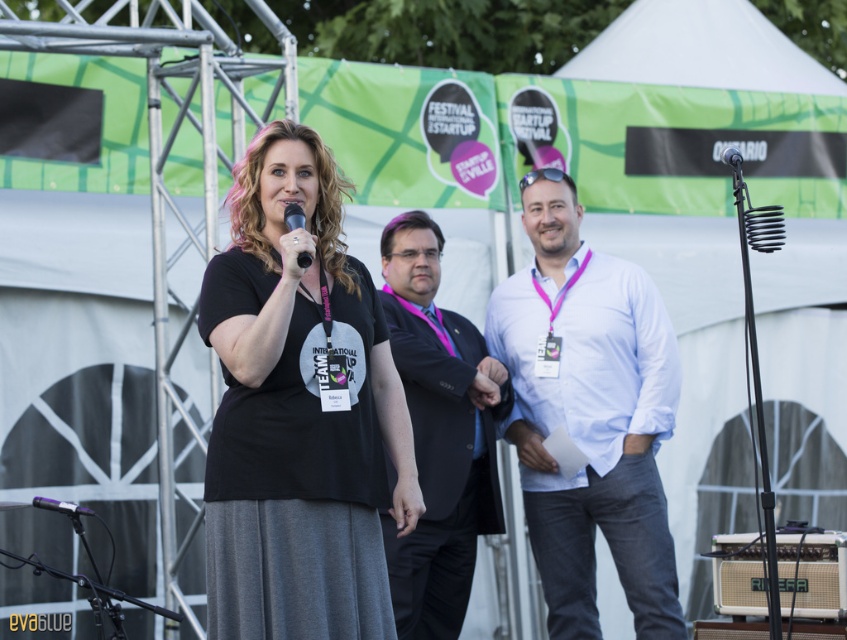
Question: Which object is closer to the camera taking this photo?

Choices:
 (A) metallic purple microphone at lower left
 (B) beige fabric speaker at lower right

Answer: (A)

Question: Which of the following is the farthest from the observer?

Choices:
 (A) (79, 506)
 (B) (724, 577)
 (C) (289, 228)
 (D) (591, 529)

Answer: (D)

Question: Which object is farther from the camera taking this photo?

Choices:
 (A) black matte t-shirt at center
 (B) beige fabric speaker at lower right
 (C) white cotton shirt at center
 (D) black suit at center

Answer: (C)

Question: Is white cotton shirt at center above black suit at center?

Choices:
 (A) yes
 (B) no

Answer: (A)

Question: Is black suit at center positioned at the back of metallic purple microphone at lower left?

Choices:
 (A) no
 (B) yes

Answer: (B)

Question: Can you confirm if white cotton shirt at center is thinner than metallic purple microphone at lower left?

Choices:
 (A) no
 (B) yes

Answer: (A)